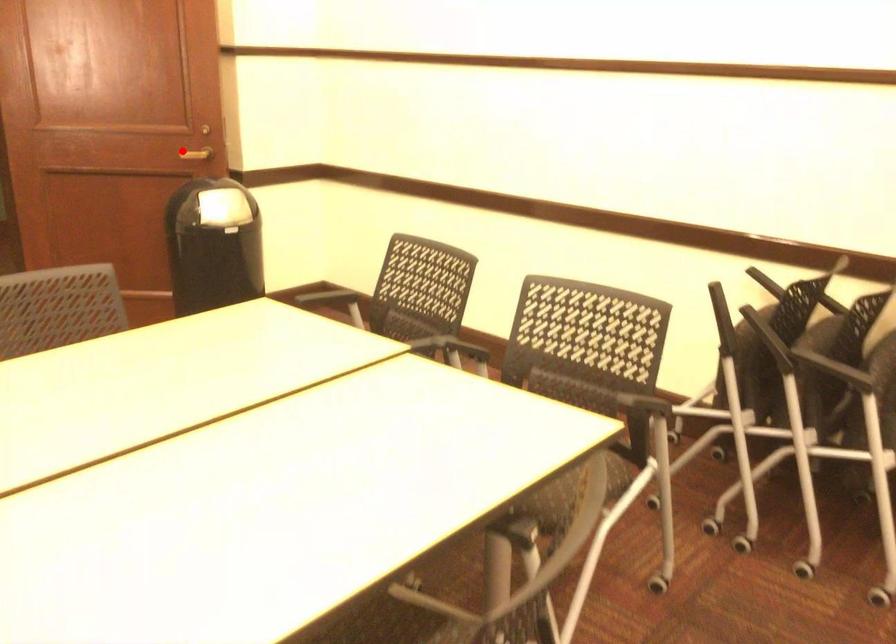
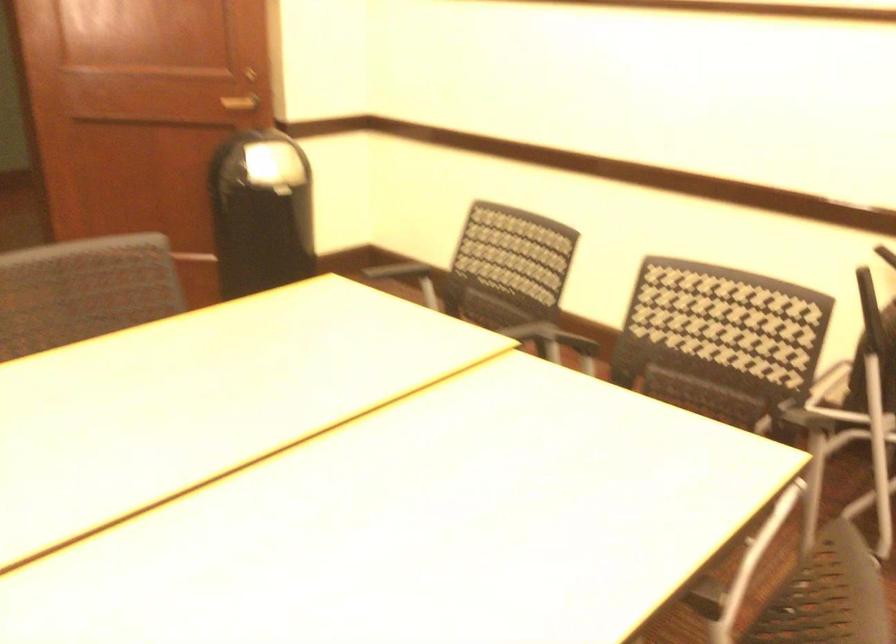
Question: A red point is marked in image1. In image2, is the corresponding 3D point closer to the camera or farther? Reply with the corresponding letter.

Choices:
 (A) The corresponding 3D point is closer.
 (B) The corresponding 3D point is farther.

Answer: (A)